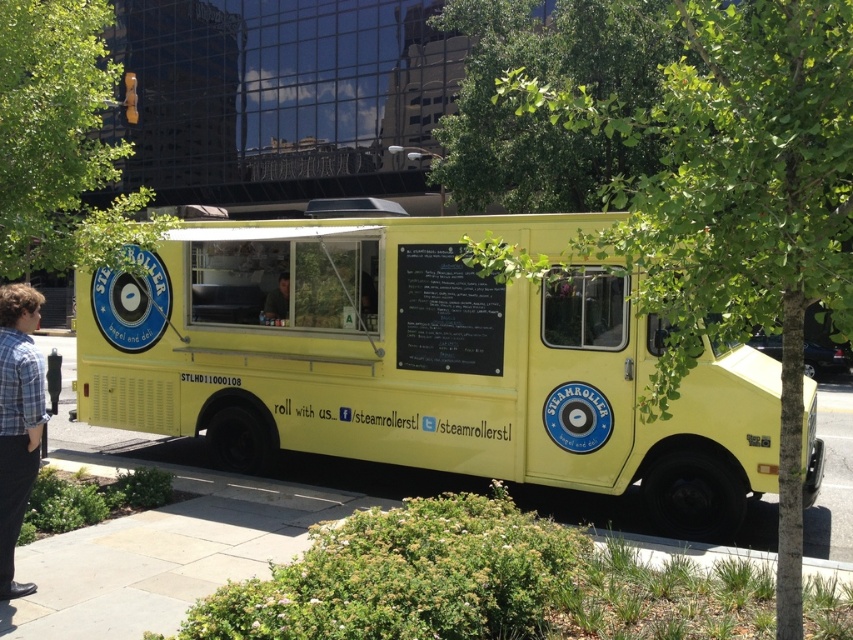
Between point (20, 1) and point (285, 310), which one is positioned behind?

Point (285, 310)

Is green leafy tree at upper center wider than matte black shirt at center?

Correct, the width of green leafy tree at upper center exceeds that of matte black shirt at center.

The width and height of the screenshot is (853, 640). Describe the element at coordinates (62, 141) in the screenshot. I see `green leafy tree at upper center` at that location.

This screenshot has height=640, width=853. What are the coordinates of `green leafy tree at upper center` in the screenshot? It's located at (62, 141).

Does green leafy tree at center lie behind matte black shirt at center?

No.

From the picture: Is green leafy tree at center to the right of matte black shirt at center from the viewer's perspective?

Indeed, green leafy tree at center is positioned on the right side of matte black shirt at center.

Identify the location of green leafy tree at center. (728, 195).

Identify the location of green leafy tree at center. (728, 195).

Can you confirm if green leafy tree at center is smaller than plaid shirt at left?

Incorrect, green leafy tree at center is not smaller in size than plaid shirt at left.

At what (x,y) coordinates should I click in order to perform the action: click on green leafy tree at center. Please return your answer as a coordinate pair (x, y). This screenshot has height=640, width=853. Looking at the image, I should click on 728,195.

What do you see at coordinates (728, 195) in the screenshot? I see `green leafy tree at center` at bounding box center [728, 195].

I want to click on green leafy tree at center, so click(728, 195).